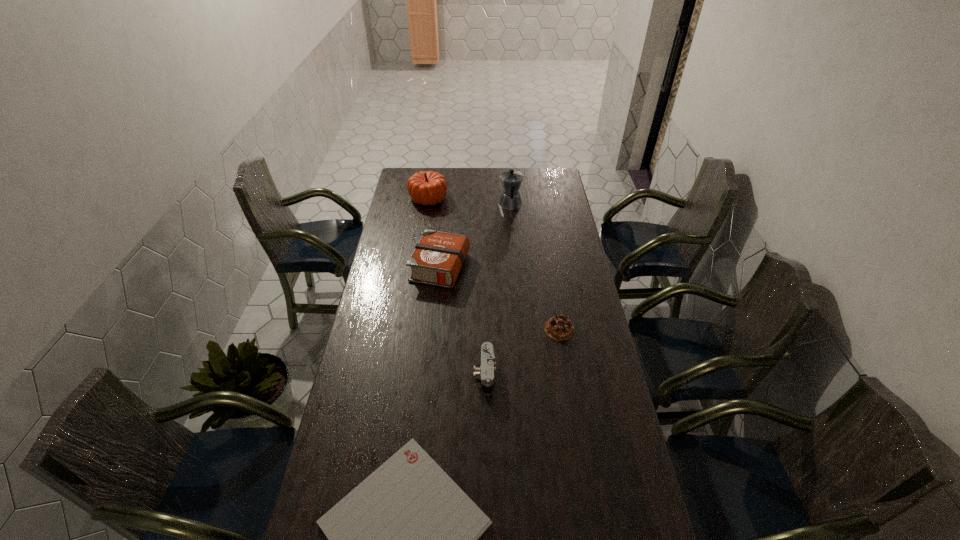
The image size is (960, 540). Find the location of `vacant space located 0.090m at the spout of the tallest object`. vacant space located 0.090m at the spout of the tallest object is located at coordinates (509, 186).

This screenshot has height=540, width=960. What are the coordinates of `free space located 0.070m at the spout of the tallest object` in the screenshot? It's located at (509, 188).

You are a GUI agent. You are given a task and a screenshot of the screen. Output one action in this format:
    pyautogui.click(x=<x>, y=<y>)
    Task: Click on the free space located 0.160m on the back of the fifth shortest object
    The height and width of the screenshot is (540, 960).
    Given the screenshot: What is the action you would take?
    pyautogui.click(x=432, y=172)

The width and height of the screenshot is (960, 540). Find the location of `free space located 0.180m on the right of the Bible`. free space located 0.180m on the right of the Bible is located at coordinates (510, 267).

In order to click on vacant space located on the lens of the third shortest object in this screenshot , I will do coord(405,374).

Find the location of `vacant space located on the lens of the third shortest object`. vacant space located on the lens of the third shortest object is located at coordinates (377, 374).

The image size is (960, 540). In order to click on vacant area located 0.060m on the lens of the third shortest object in this screenshot , I will do (x=457, y=374).

At what (x,y) coordinates should I click in order to perform the action: click on free point located 0.070m on the left of the second shortest object. Please return your answer as a coordinate pair (x, y). The width and height of the screenshot is (960, 540). Looking at the image, I should click on (525, 329).

What are the coordinates of `object that is positioned at the far edge` in the screenshot? It's located at (426, 187).

Identify the location of pumpkin positioned at the left edge. (426, 187).